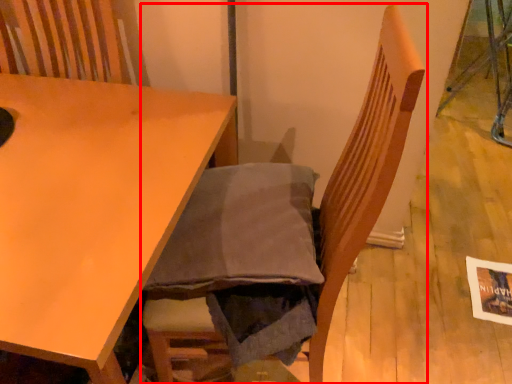
Question: From the image's perspective, considering the relative positions of chair (annotated by the red box) and table in the image provided, where is chair (annotated by the red box) located with respect to the staircase?

Choices:
 (A) below
 (B) above

Answer: (B)